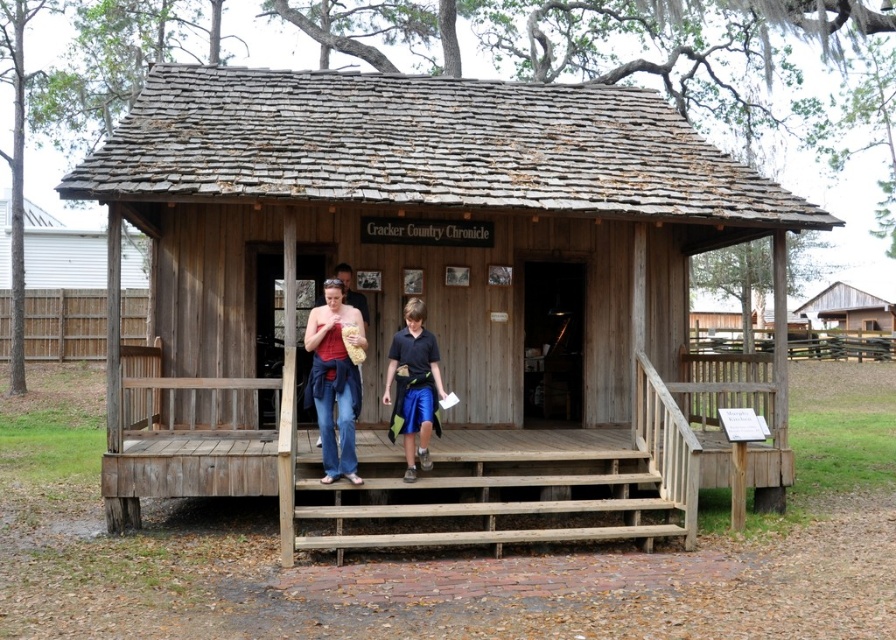
Question: Which point appears closest to the camera in this image?

Choices:
 (A) (407, 390)
 (B) (679, 499)
 (C) (246, 88)

Answer: (A)

Question: Among these objects, which one is nearest to the camera?

Choices:
 (A) wooden porch at center
 (B) matte red tank top at center
 (C) blue athletic shorts at center

Answer: (B)

Question: Is denim jeans at center wider than matte red tank top at center?

Choices:
 (A) no
 (B) yes

Answer: (A)

Question: Is wooden log cabin at center below wooden porch at center?

Choices:
 (A) yes
 (B) no

Answer: (A)

Question: Which of the following is the closest to the observer?

Choices:
 (A) (399, 364)
 (B) (354, 403)

Answer: (B)

Question: Does wooden log cabin at center lie in front of wooden porch at center?

Choices:
 (A) yes
 (B) no

Answer: (A)